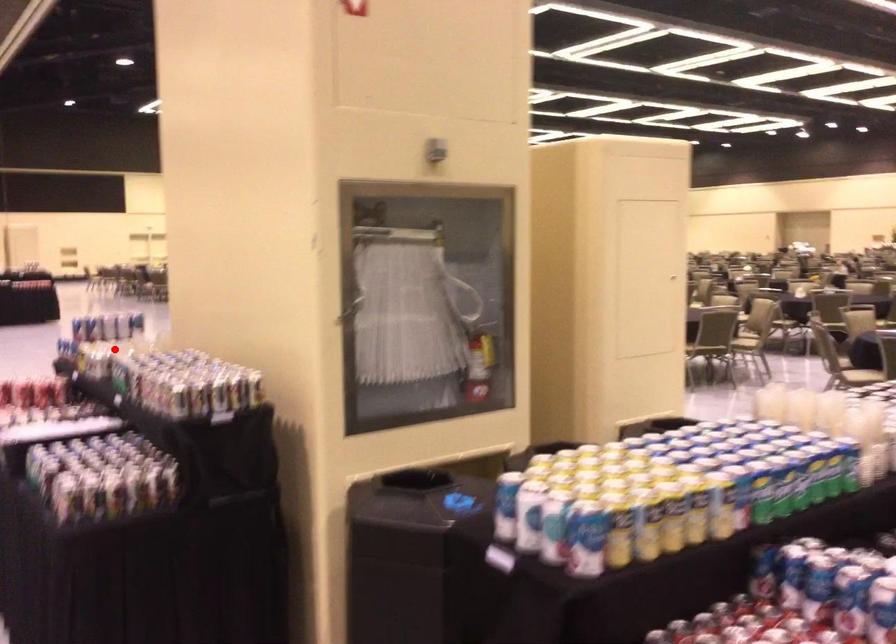
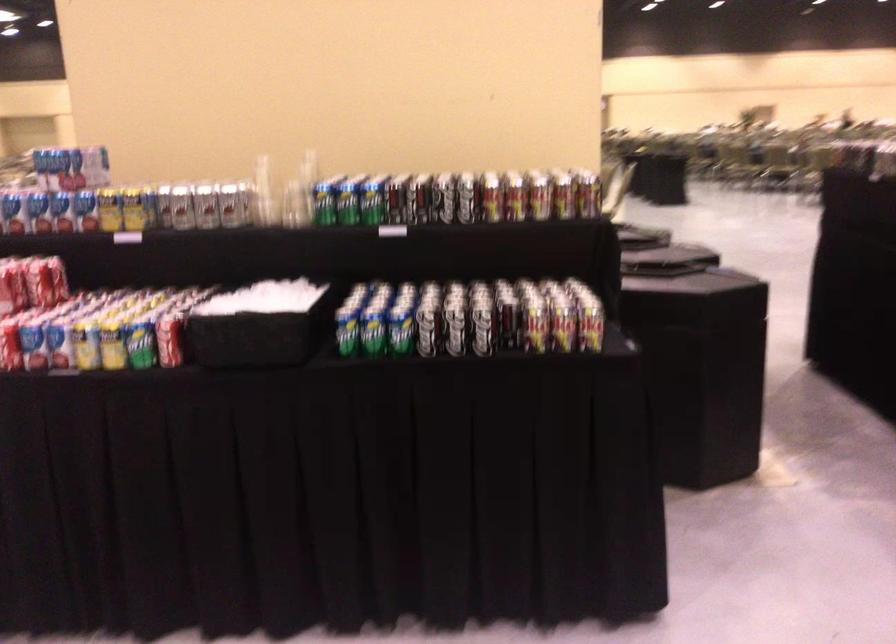
Question: A red point is marked in image1. In image2, is the corresponding 3D point closer to the camera or farther? Reply with the corresponding letter.

Choices:
 (A) The corresponding 3D point is closer.
 (B) The corresponding 3D point is farther.

Answer: (A)